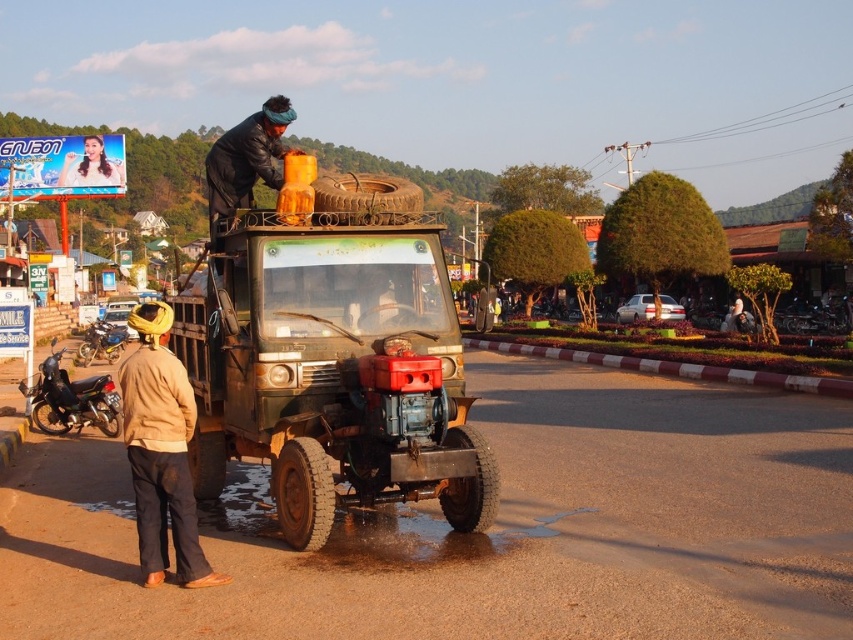
You are a photographer positioned on the rural street scene. You want to take a photo of the brushed metal motorcycle at left without the black leather jacket at upper center blocking it. Is the motorcycle visible in the current setup?

The black leather jacket at upper center is in front of the brushed metal motorcycle at left, so it is blocking the view of the motorcycle. To take a photo of the motorcycle without the jacket blocking it, you would need to adjust your position or angle to move the jacket out of the frame or have the jacket moved.

You are standing on the rural street scene and want to know what is located at the coordinates point [247,160]. What object is there?

The point [247,160] corresponds to the black leather jacket at upper center.

You are a delivery person who needs to place a black leather jacket at upper center onto a shelf that can hold items up to 45 feet away from the shelf. The shelf is located where the brushed metal motorcycle at left is. Can the jacket be placed on the shelf?

The black leather jacket at upper center is 44.03 feet from the brushed metal motorcycle at left, so yes, the jacket can be placed on the shelf since the distance is within the shelf capacity of 45 feet.